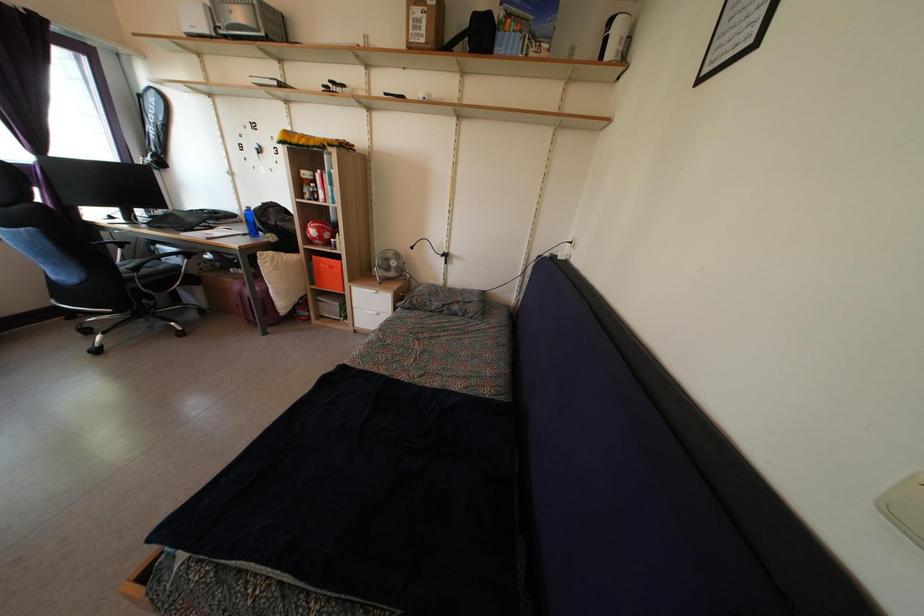
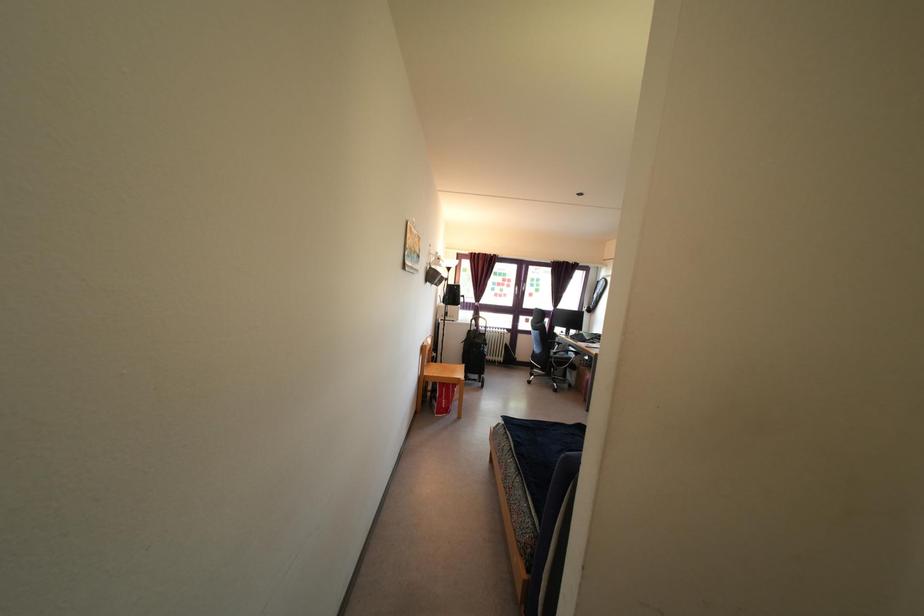
Find the pixel in the second image that matches point (139, 278) in the first image.

(557, 362)